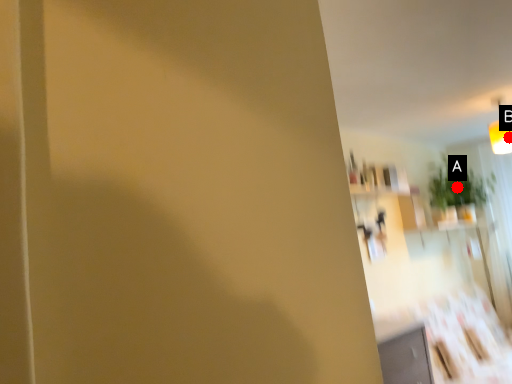
Question: Two points are circled on the image, labeled by A and B beside each circle. Which point is closer to the camera taking this photo?

Choices:
 (A) A is closer
 (B) B is closer

Answer: (B)